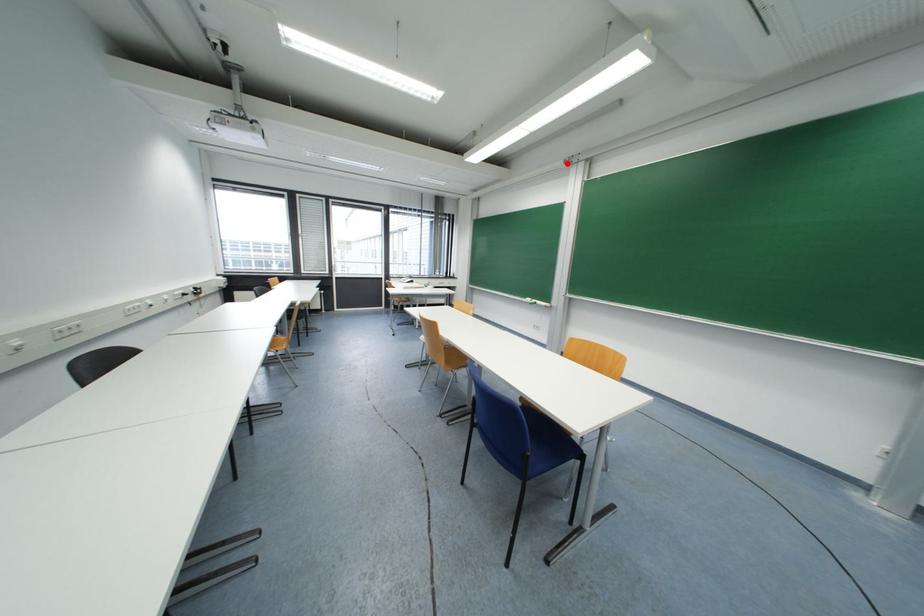
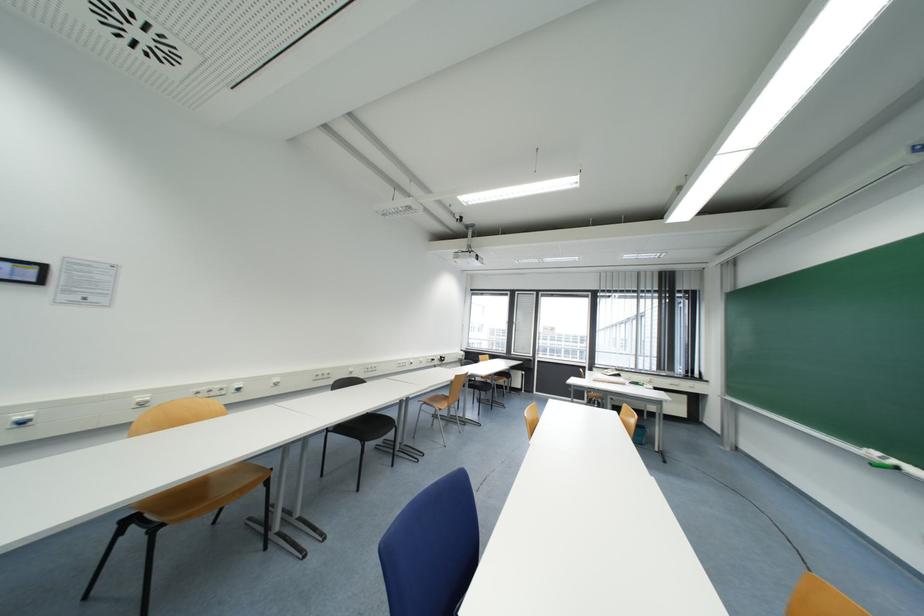
The point at the highlighted location is marked in the first image. Where is the corresponding point in the second image?

(909, 154)